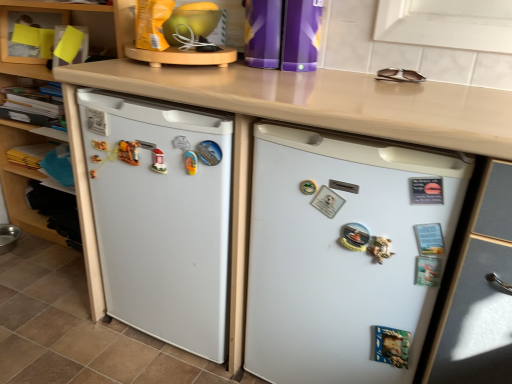
Question: Is point (3, 46) positioned closer to the camera than point (166, 327)?

Choices:
 (A) closer
 (B) farther

Answer: (B)

Question: Is yellow paper at upper left, arranged as the first shelf when viewed from the top, taller or shorter than white matte refrigerator at left, which ranks as the first refrigerator in left-to-right order?

Choices:
 (A) short
 (B) tall

Answer: (A)

Question: Estimate the real-world distances between objects in this image. Which object is closer to the white matte refrigerator at left, which ranks as the first refrigerator in left-to-right order?

Choices:
 (A) white matte refrigerator at center, which appears as the 2th refrigerator when viewed from the left
 (B) white matte refrigerator at left
 (C) wooden shelf at lower left, the 2th shelf from the top
 (D) yellow paper at upper left, the 2th shelf ordered from the bottom

Answer: (A)

Question: Estimate the real-world distances between objects in this image. Which object is farther from the white matte refrigerator at left, which ranks as the first refrigerator in left-to-right order?

Choices:
 (A) yellow paper at upper left, the 2th shelf ordered from the bottom
 (B) white matte refrigerator at left
 (C) white matte refrigerator at center, acting as the 1th refrigerator starting from the right
 (D) wooden shelf at lower left, which is the first shelf in bottom-to-top order

Answer: (A)